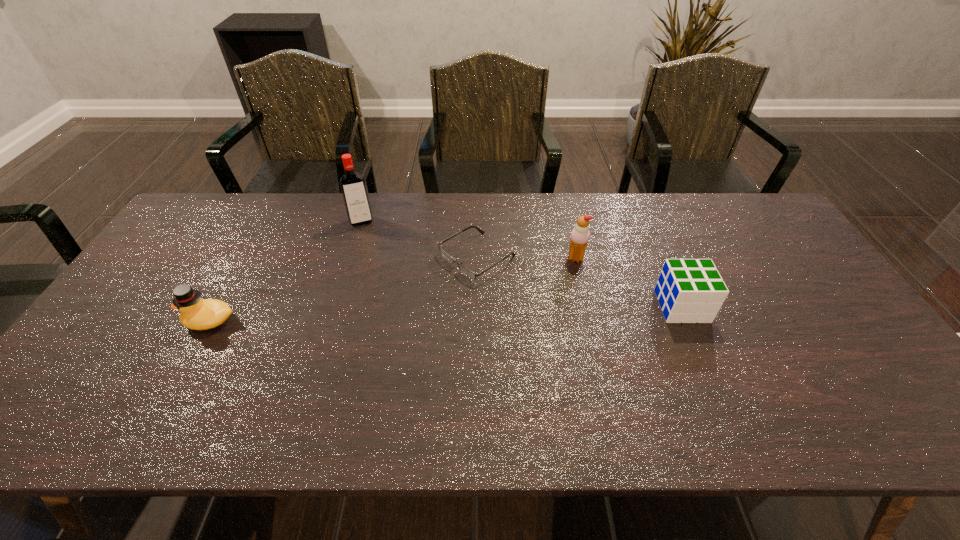
Find the location of a particular element. The width and height of the screenshot is (960, 540). vacant space on the desktop that is between the duck and the cube and is positioned on the front-facing side of the shortest object is located at coordinates (382, 315).

This screenshot has height=540, width=960. Identify the location of vacant space on the desktop that is between the leftmost object and the cube and is positioned at the front with a straw on the fourth object from left to right. (478, 313).

At what (x,y) coordinates should I click in order to perform the action: click on vacant spot on the desktop that is between the duck and the rightmost object and is positioned on the front and back of the tallest object. Please return your answer as a coordinate pair (x, y). The width and height of the screenshot is (960, 540). Looking at the image, I should click on (389, 315).